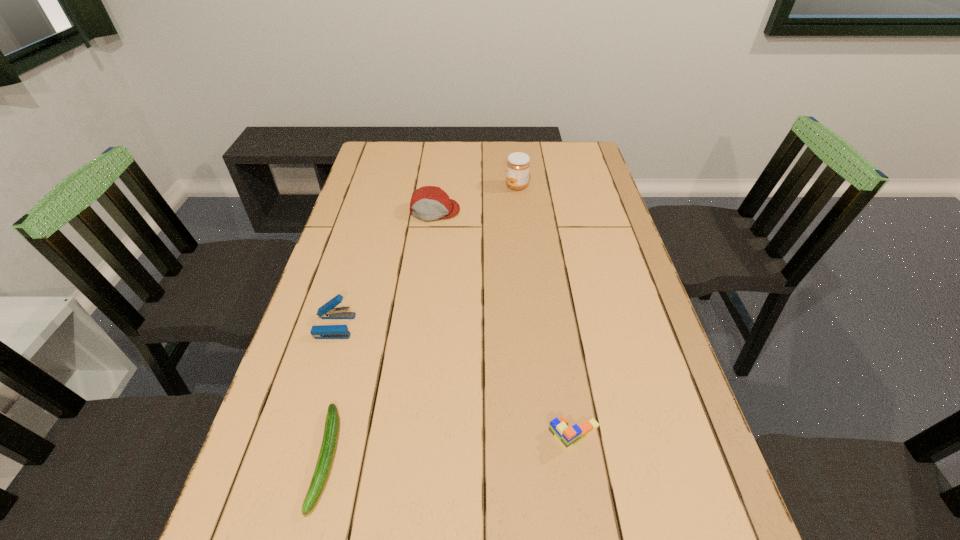
At what (x,y) coordinates should I click in order to perform the action: click on the farthest object. Please return your answer as a coordinate pair (x, y). Looking at the image, I should click on (517, 175).

Where is `jam`? The height and width of the screenshot is (540, 960). jam is located at coordinates (517, 175).

Where is `cap`? The width and height of the screenshot is (960, 540). cap is located at coordinates (427, 203).

Where is `the third object from left to right`? the third object from left to right is located at coordinates (427, 203).

You are a GUI agent. You are given a task and a screenshot of the screen. Output one action in this format:
    pyautogui.click(x=<x>, y=<y>)
    Task: Click on the third nearest object
    
    Given the screenshot: What is the action you would take?
    pyautogui.click(x=328, y=311)

The image size is (960, 540). Identify the location of Lego. (567, 436).

Locate an element on the screen. Image resolution: width=960 pixels, height=540 pixels. the shortest object is located at coordinates (331, 430).

At what (x,y) coordinates should I click in order to perform the action: click on blank space located 0.390m on the front label of the tallest object. Please return your answer as a coordinate pair (x, y). The image size is (960, 540). Looking at the image, I should click on (394, 186).

What are the coordinates of `free space located 0.240m on the front label of the tallest object` in the screenshot? It's located at (437, 186).

Identify the location of vacant space located on the front label of the tallest object. The width and height of the screenshot is (960, 540). (466, 186).